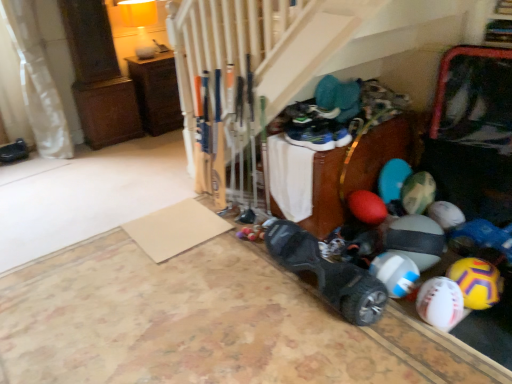
Question: Should I look upward or downward to see brown wood cabinet at upper left?

Choices:
 (A) up
 (B) down

Answer: (A)

Question: Can you confirm if brown wood cabinet at upper left is positioned to the left of black matte shoe at left, acting as the first footwear starting from the back?

Choices:
 (A) yes
 (B) no

Answer: (B)

Question: From the image's perspective, is brown wood cabinet at upper left over black matte shoe at left, marked as the 3th footwear in a front-to-back arrangement?

Choices:
 (A) no
 (B) yes

Answer: (B)

Question: From the image's perspective, does brown wood cabinet at upper left appear lower than black matte shoe at left, acting as the first footwear starting from the back?

Choices:
 (A) no
 (B) yes

Answer: (A)

Question: Does brown wood cabinet at upper left lie in front of black matte shoe at left, the third footwear viewed from the right?

Choices:
 (A) no
 (B) yes

Answer: (A)

Question: Are brown wood cabinet at upper left and black matte shoe at left, arranged as the 1th footwear when viewed from the left, making contact?

Choices:
 (A) no
 (B) yes

Answer: (A)

Question: Is black matte shoe at left, the 3th footwear ordered from the bottom, at the back of brown wood cabinet at upper left?

Choices:
 (A) no
 (B) yes

Answer: (A)

Question: Does brown wood cabinet at upper left have a larger size compared to white matte beach ball at lower right, which is the second beach ball from right to left?

Choices:
 (A) yes
 (B) no

Answer: (A)

Question: Is the position of brown wood cabinet at upper left more distant than that of white matte beach ball at lower right, which ranks as the second beach ball in left-to-right order?

Choices:
 (A) yes
 (B) no

Answer: (A)

Question: From the image's perspective, is brown wood cabinet at upper left located beneath white matte beach ball at lower right, which ranks as the second beach ball in left-to-right order?

Choices:
 (A) yes
 (B) no

Answer: (B)

Question: Does brown wood cabinet at upper left touch white matte beach ball at lower right, which ranks as the second beach ball in left-to-right order?

Choices:
 (A) yes
 (B) no

Answer: (B)

Question: Is brown wood cabinet at upper left shorter than white matte beach ball at lower right, which ranks as the second beach ball in left-to-right order?

Choices:
 (A) yes
 (B) no

Answer: (B)

Question: Is brown wood cabinet at upper left to the left of white matte beach ball at lower right, which is the second beach ball from right to left, from the viewer's perspective?

Choices:
 (A) no
 (B) yes

Answer: (B)

Question: Does black matte shoe at left, the 3th footwear ordered from the bottom, have a greater width compared to white fabric curtain at left?

Choices:
 (A) no
 (B) yes

Answer: (A)